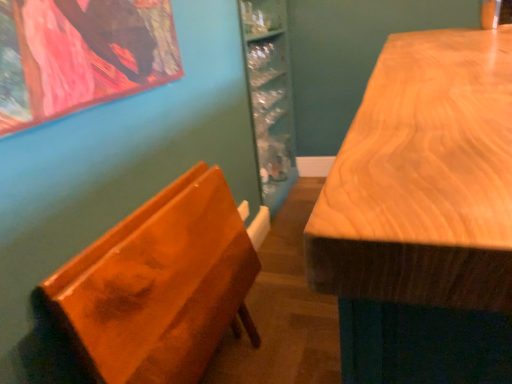
Question: Do you think wooden table at right is within glossy wood chair at left, or outside of it?

Choices:
 (A) inside
 (B) outside

Answer: (B)

Question: Considering the positions of wooden table at right and glossy wood chair at left in the image, is wooden table at right taller or shorter than glossy wood chair at left?

Choices:
 (A) short
 (B) tall

Answer: (B)

Question: From a real-world perspective, is wooden table at right above or below glossy wood chair at left?

Choices:
 (A) below
 (B) above

Answer: (B)

Question: Is glossy wood chair at left to the left or to the right of wooden table at right in the image?

Choices:
 (A) left
 (B) right

Answer: (A)

Question: From a real-world perspective, is glossy wood chair at left positioned above or below wooden table at right?

Choices:
 (A) below
 (B) above

Answer: (A)

Question: Looking at their shapes, would you say glossy wood chair at left is wider or thinner than wooden table at right?

Choices:
 (A) wide
 (B) thin

Answer: (B)

Question: Considering the positions of glossy wood chair at left and wooden table at right in the image, is glossy wood chair at left bigger or smaller than wooden table at right?

Choices:
 (A) small
 (B) big

Answer: (A)